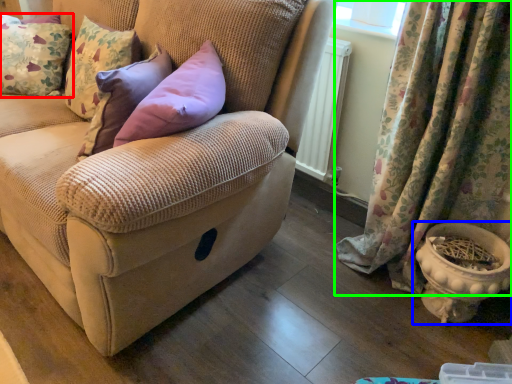
Question: Based on their relative distances, which object is farther from pillow (highlighted by a red box)? Choose from flowerpot (highlighted by a blue box) and curtain (highlighted by a green box).

Choices:
 (A) flowerpot
 (B) curtain

Answer: (A)